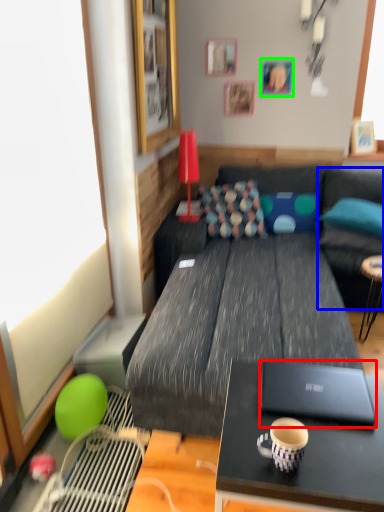
Question: Which is nearer to the laptop (highlighted by a red box)? bean bag chair (highlighted by a blue box) or picture frame (highlighted by a green box).

Choices:
 (A) bean bag chair
 (B) picture frame

Answer: (A)